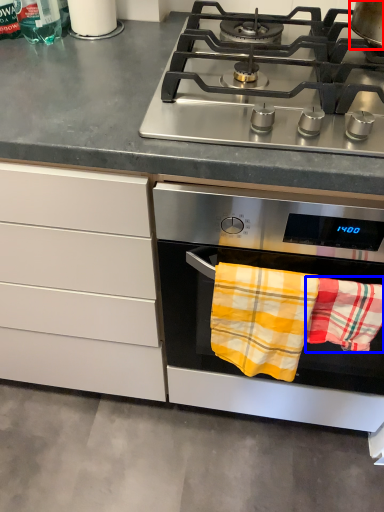
Question: Among these objects, which one is nearest to the camera, kitchen appliance (highlighted by a red box) or beach towel (highlighted by a blue box)?

Choices:
 (A) kitchen appliance
 (B) beach towel

Answer: (A)